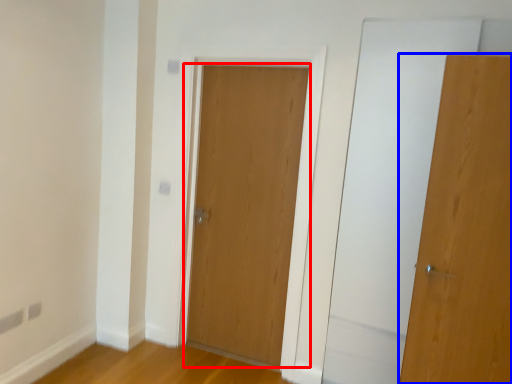
Question: Among these objects, which one is farthest to the camera, door (highlighted by a red box) or door (highlighted by a blue box)?

Choices:
 (A) door
 (B) door

Answer: (A)